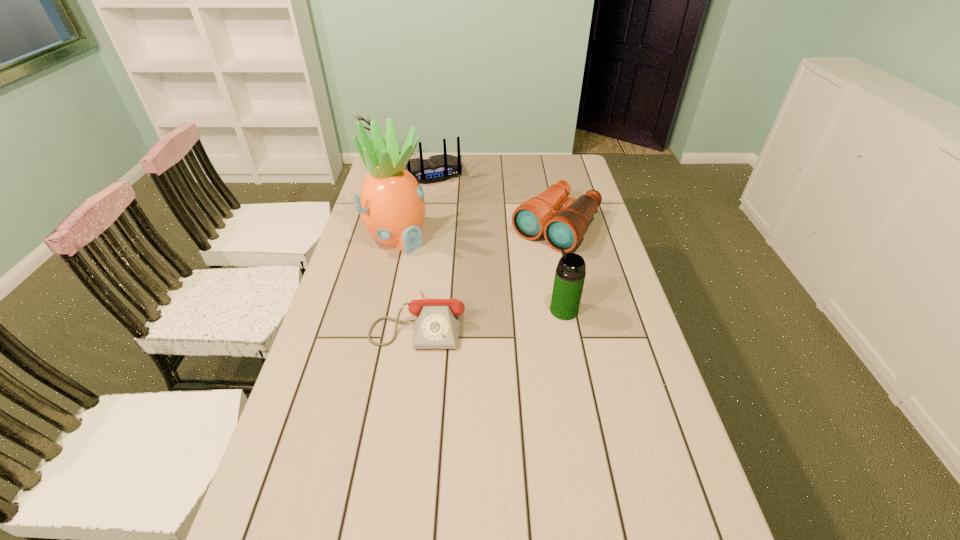
Locate an element on the screen. blank region between the fourth shortest object and the tallest object is located at coordinates (481, 273).

The image size is (960, 540). I want to click on free space between the third tallest object and the thermos bottle, so click(496, 242).

Choose which object is the fourth nearest neighbor to the tallest object. Please provide its 2D coordinates. Your answer should be formatted as a tuple, i.e. [(x, y)], where the tuple contains the x and y coordinates of a point satisfying the conditions above.

[(570, 273)]

Select which object appears as the second closest to the third shortest object. Please provide its 2D coordinates. Your answer should be formatted as a tuple, i.e. [(x, y)], where the tuple contains the x and y coordinates of a point satisfying the conditions above.

[(564, 229)]

Find the location of `free space that satisfies the following two spatial constraints: 1. on the back side of the tallest object; 2. on the right side of the binoculars`. free space that satisfies the following two spatial constraints: 1. on the back side of the tallest object; 2. on the right side of the binoculars is located at coordinates (399, 227).